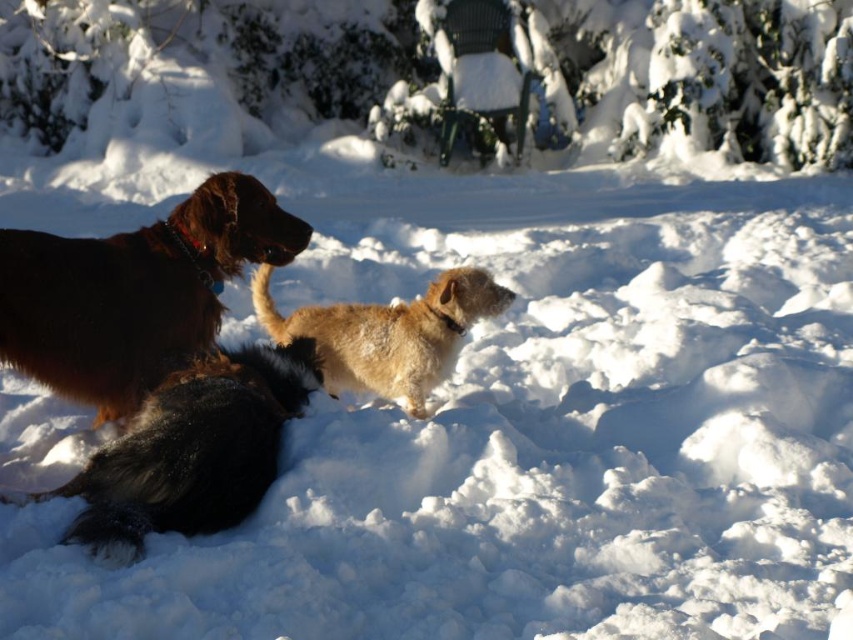
Does shiny brown fur at left lie in front of fuzzy brown dog at center?

Yes, it is.

Does shiny brown fur at left have a lesser height compared to fuzzy brown dog at center?

Incorrect, shiny brown fur at left's height does not fall short of fuzzy brown dog at center's.

The height and width of the screenshot is (640, 853). In order to click on shiny brown fur at left in this screenshot , I will do `click(134, 292)`.

Can you confirm if black fluffy dog at left is wider than fuzzy brown dog at center?

Incorrect, black fluffy dog at left's width does not surpass fuzzy brown dog at center's.

Is point (160, 516) closer to camera compared to point (328, 364)?

Yes, point (160, 516) is in front of point (328, 364).

Identify the location of black fluffy dog at left. The width and height of the screenshot is (853, 640). (193, 451).

Is point (158, 253) less distant than point (209, 480)?

No, it is behind (209, 480).

Between point (41, 280) and point (109, 493), which one is positioned behind?

The point (41, 280) is behind.

Image resolution: width=853 pixels, height=640 pixels. I want to click on shiny brown fur at left, so click(x=134, y=292).